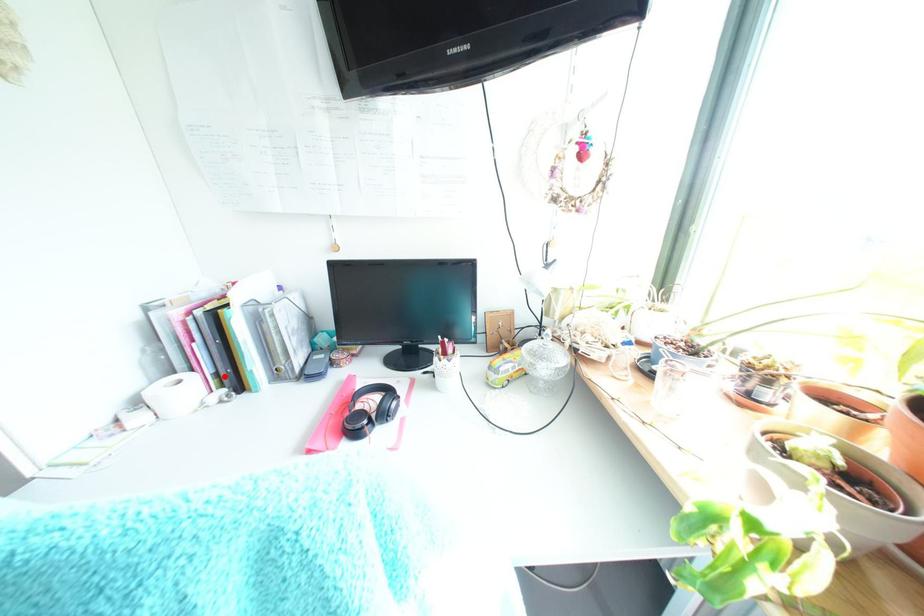
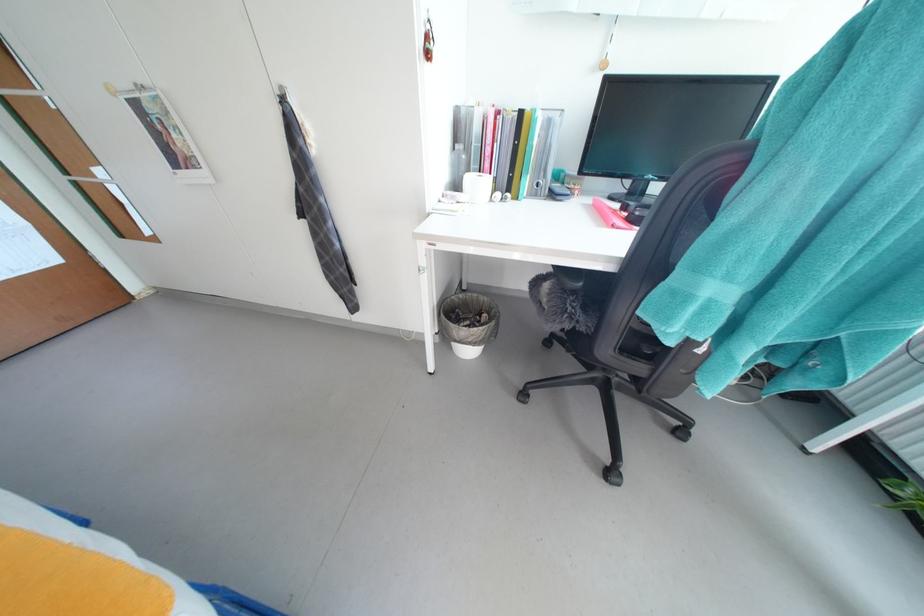
Locate, in the second image, the point that corresponds to the highlighted location in the first image.

(503, 182)